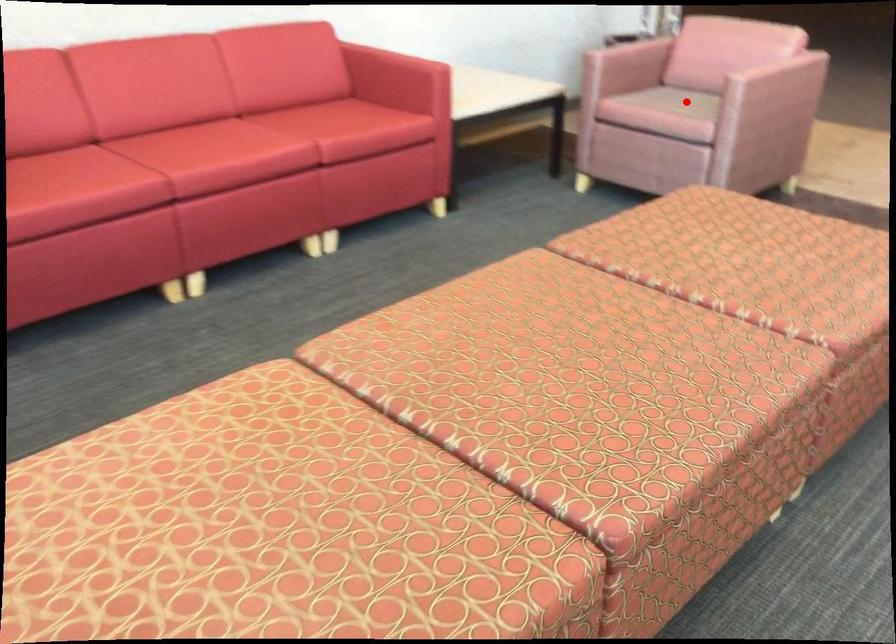
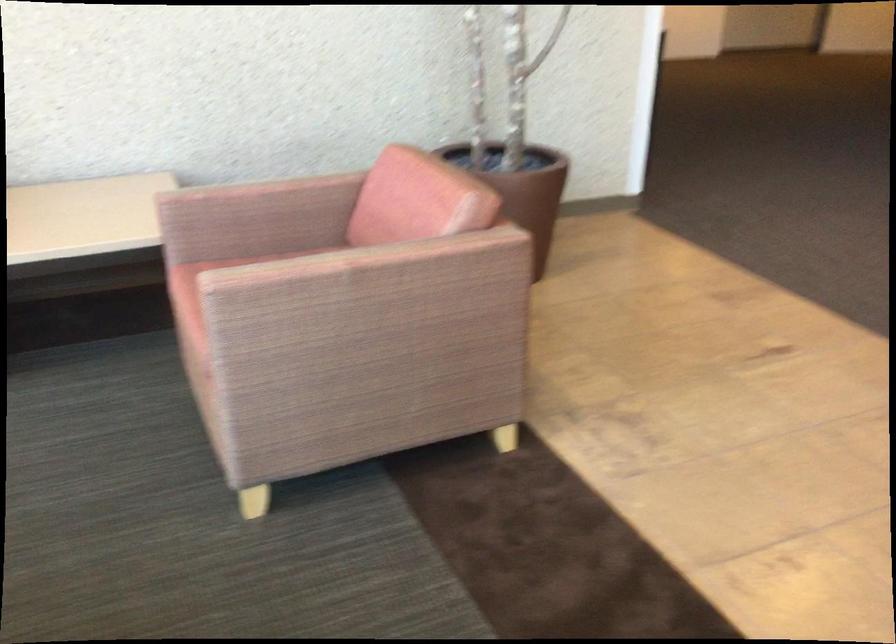
Question: I am providing you with two images of the same scene from different viewpoints. A red point is marked on the first image. Is the red point's position out of view in image 2?

Choices:
 (A) Yes
 (B) No

Answer: (A)